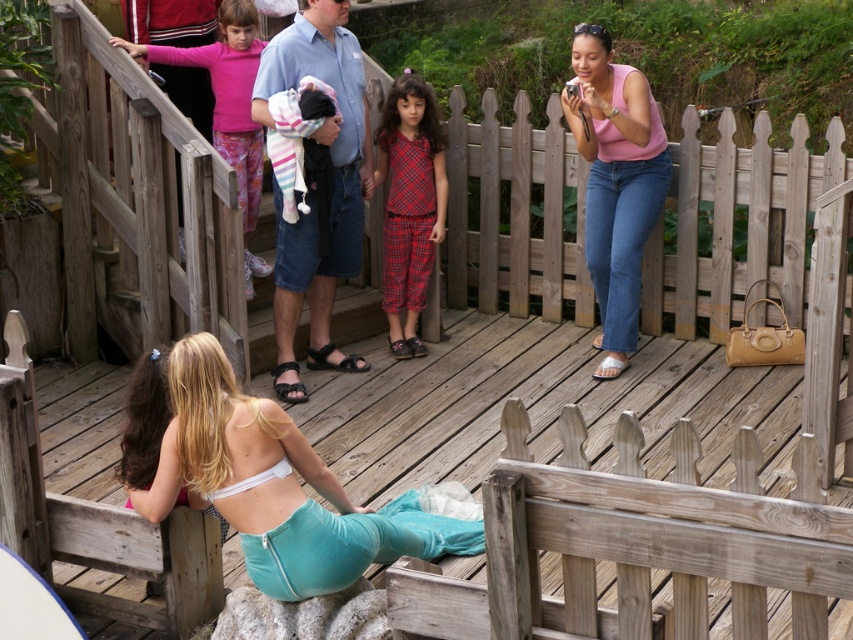
Question: Which of the following is the closest to the observer?

Choices:
 (A) (202, 371)
 (B) (230, 132)

Answer: (A)

Question: Which object is farther from the camera taking this photo?

Choices:
 (A) white matte bikini top at lower center
 (B) plaid fabric pajamas at center

Answer: (B)

Question: Which is nearer to the pink matte tank top at upper right?

Choices:
 (A) white matte bikini top at lower center
 (B) pink fabric at upper left
 (C) plaid fabric pajamas at center

Answer: (C)

Question: Does white matte bikini top at lower center appear on the right side of pink fabric at upper left?

Choices:
 (A) yes
 (B) no

Answer: (A)

Question: Is pink matte tank top at upper right smaller than pink fabric at upper left?

Choices:
 (A) no
 (B) yes

Answer: (B)

Question: Is pink matte tank top at upper right bigger than plaid fabric pajamas at center?

Choices:
 (A) no
 (B) yes

Answer: (B)